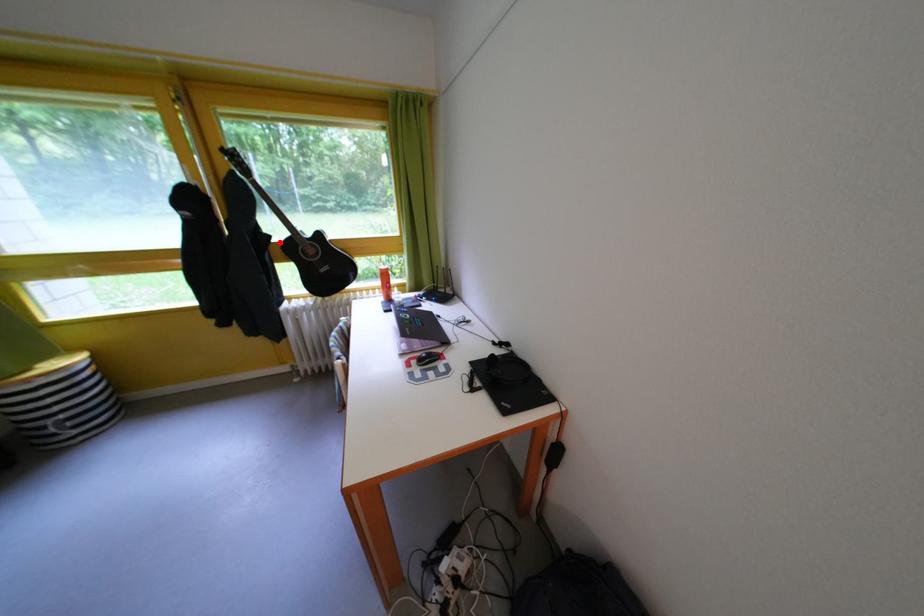
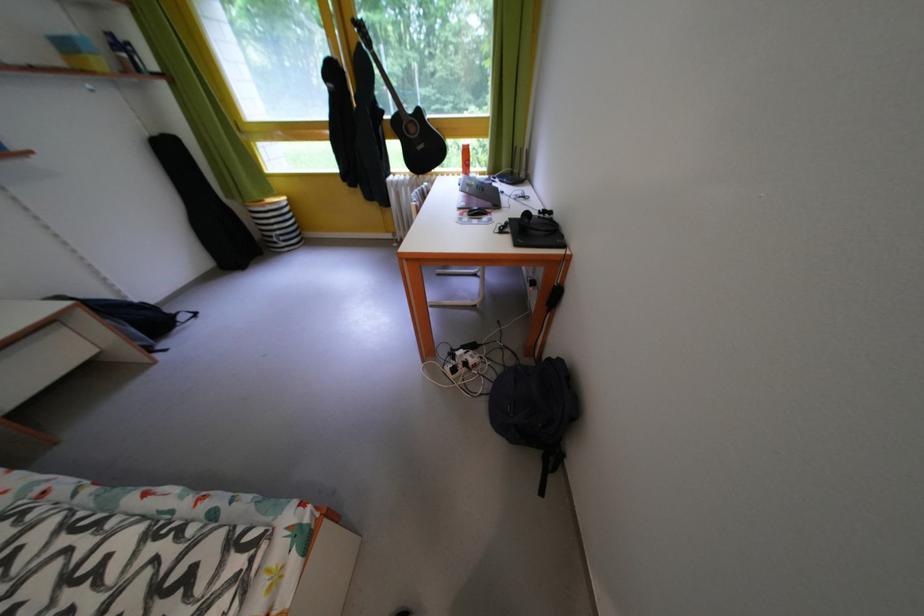
Find the pixel in the second image that matches the highlighted location in the first image.

(393, 118)